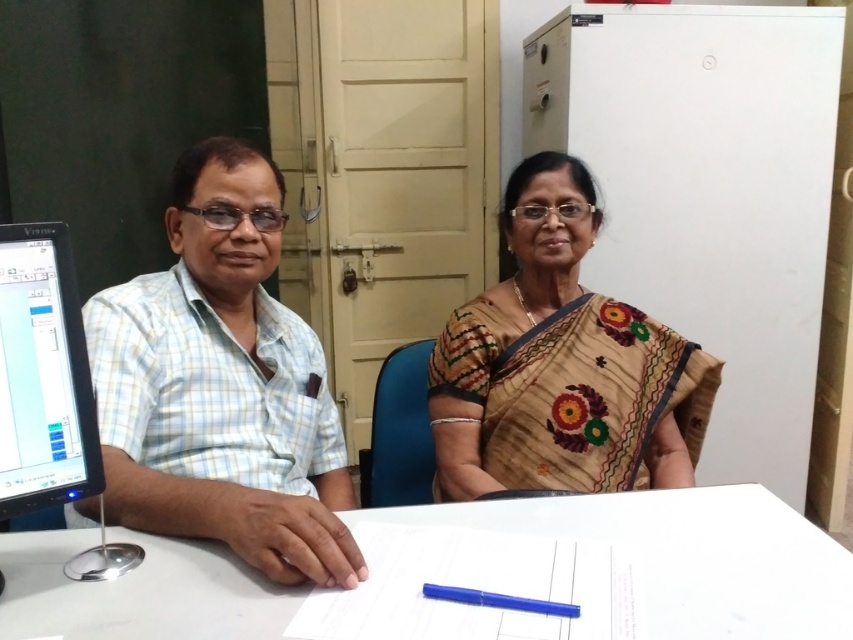
Is light blue checkered shirt at left to the right of black glossy monitor at left from the viewer's perspective?

Indeed, light blue checkered shirt at left is positioned on the right side of black glossy monitor at left.

Who is taller, light blue checkered shirt at left or black glossy monitor at left?

light blue checkered shirt at left is taller.

Is point (198, 182) positioned after point (44, 403)?

That is True.

What are the coordinates of `light blue checkered shirt at left` in the screenshot? It's located at (221, 385).

Is light brown fabric saree at center above light blue checkered shirt at left?

Indeed, light brown fabric saree at center is positioned over light blue checkered shirt at left.

Between light brown fabric saree at center and light blue checkered shirt at left, which one is positioned lower?

light blue checkered shirt at left

Describe the element at coordinates (561, 365) in the screenshot. I see `light brown fabric saree at center` at that location.

Find the location of a particular element. The image size is (853, 640). light brown fabric saree at center is located at coordinates (561, 365).

Can you confirm if light brown fabric saree at center is smaller than beige embroidered saree at center?

Incorrect, light brown fabric saree at center is not smaller in size than beige embroidered saree at center.

Who is positioned more to the left, light brown fabric saree at center or beige embroidered saree at center?

light brown fabric saree at center is more to the left.

At what (x,y) coordinates should I click in order to perform the action: click on light brown fabric saree at center. Please return your answer as a coordinate pair (x, y). The image size is (853, 640). Looking at the image, I should click on (561, 365).